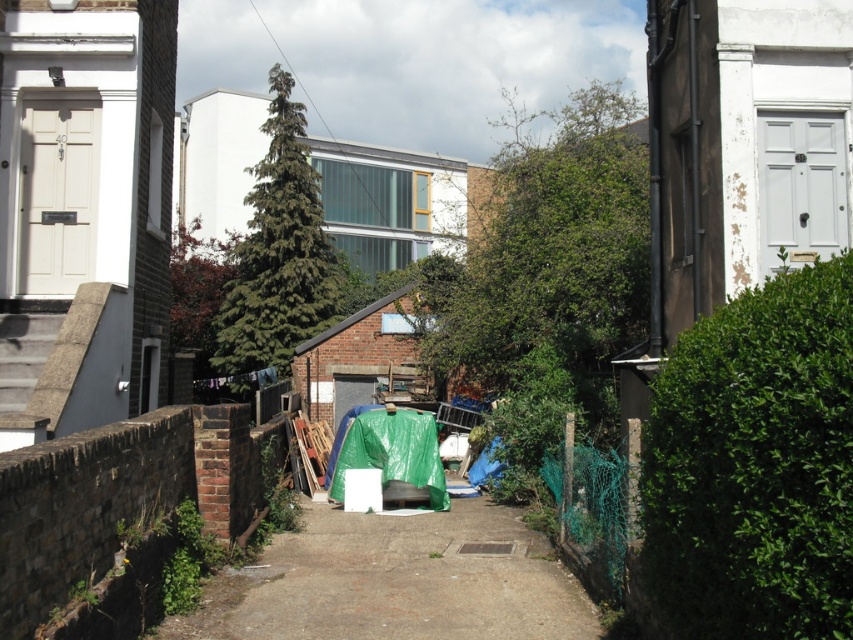
Is dull concrete path at center above green leafy hedge at center?

Actually, dull concrete path at center is below green leafy hedge at center.

Does dull concrete path at center have a greater height compared to green leafy hedge at center?

No.

At what (x,y) coordinates should I click in order to perform the action: click on dull concrete path at center. Please return your answer as a coordinate pair (x, y). The image size is (853, 640). Looking at the image, I should click on (396, 582).

Between green leafy hedge at right and dull concrete path at center, which one appears on the left side from the viewer's perspective?

From the viewer's perspective, dull concrete path at center appears more on the left side.

Is green leafy hedge at right thinner than dull concrete path at center?

Yes, green leafy hedge at right is thinner than dull concrete path at center.

Does point (743, 632) come behind point (296, 545)?

No.

In order to click on green leafy hedge at right in this screenshot , I will do `click(755, 465)`.

Is green leafy hedge at right to the right of green leafy hedge at center from the viewer's perspective?

Indeed, green leafy hedge at right is positioned on the right side of green leafy hedge at center.

Does point (825, 634) come behind point (286, 116)?

No, it is in front of (286, 116).

You are a GUI agent. You are given a task and a screenshot of the screen. Output one action in this format:
    pyautogui.click(x=<x>, y=<y>)
    Task: Click on the green leafy hedge at right
    This screenshot has height=640, width=853.
    Given the screenshot: What is the action you would take?
    pyautogui.click(x=755, y=465)

At what (x,y) coordinates should I click in order to perform the action: click on green leafy hedge at right. Please return your answer as a coordinate pair (x, y). Image resolution: width=853 pixels, height=640 pixels. Looking at the image, I should click on (755, 465).